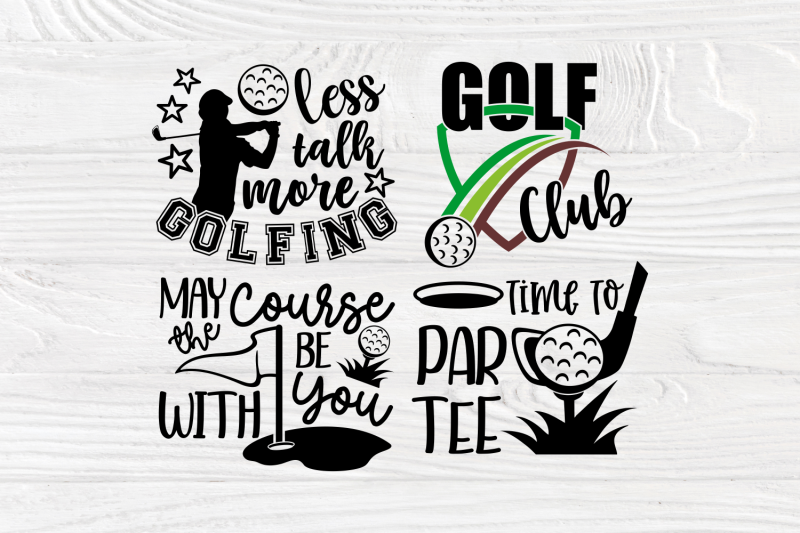
Find the location of a particular element. wood planks is located at coordinates (74, 23), (74, 102), (97, 219), (85, 342), (98, 448), (98, 507).